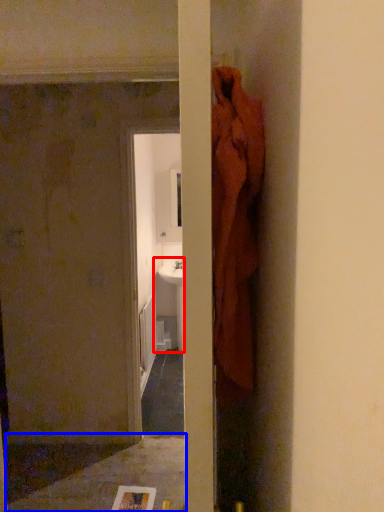
Question: Among these objects, which one is farthest to the camera, sink (highlighted by a red box) or concrete (highlighted by a blue box)?

Choices:
 (A) sink
 (B) concrete

Answer: (A)